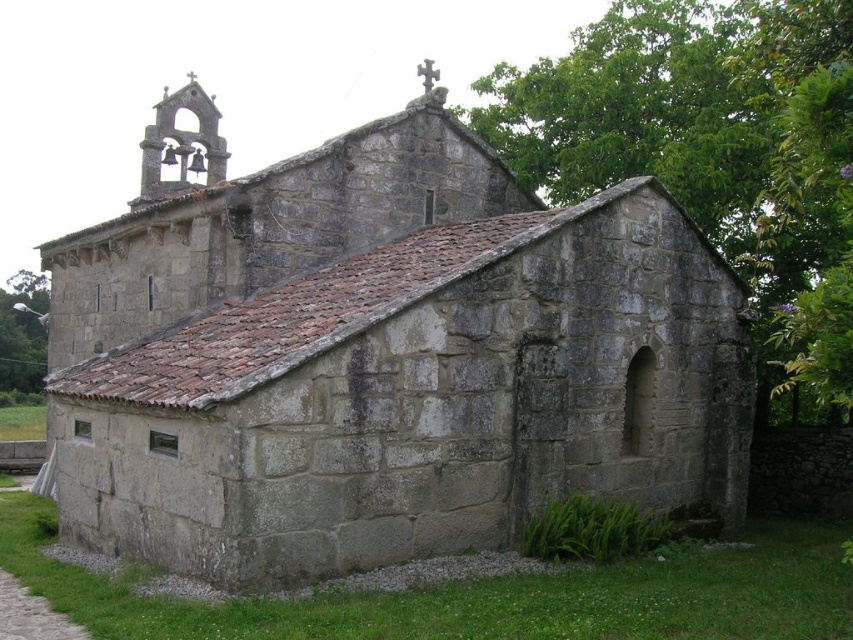
Can you confirm if gray stone church at center is positioned to the right of gray cobblestone path at lower left?

Indeed, gray stone church at center is positioned on the right side of gray cobblestone path at lower left.

Can you confirm if gray stone church at center is shorter than gray cobblestone path at lower left?

No.

Does point (461, 296) come in front of point (39, 604)?

No, it is not.

You are a GUI agent. You are given a task and a screenshot of the screen. Output one action in this format:
    pyautogui.click(x=<x>, y=<y>)
    Task: Click on the gray stone church at center
    Image resolution: width=853 pixels, height=640 pixels.
    Given the screenshot: What is the action you would take?
    pyautogui.click(x=380, y=355)

Can you confirm if gray cobblestone path at lower left is positioned above green grass at lower left?

Actually, gray cobblestone path at lower left is below green grass at lower left.

Is gray cobblestone path at lower left bigger than green grass at lower left?

Yes, gray cobblestone path at lower left is bigger than green grass at lower left.

Does point (6, 577) come farther from viewer compared to point (16, 637)?

Yes, point (6, 577) is farther from viewer.

In order to click on gray cobblestone path at lower left in this screenshot , I will do `click(32, 614)`.

Is point (471, 305) closer to camera compared to point (45, 604)?

No.

Can you confirm if gray stone church at center is wider than green grass at lower left?

Indeed, gray stone church at center has a greater width compared to green grass at lower left.

Is point (643, 196) behind point (44, 604)?

Yes.

Image resolution: width=853 pixels, height=640 pixels. Find the location of `gray stone church at center`. gray stone church at center is located at coordinates (380, 355).